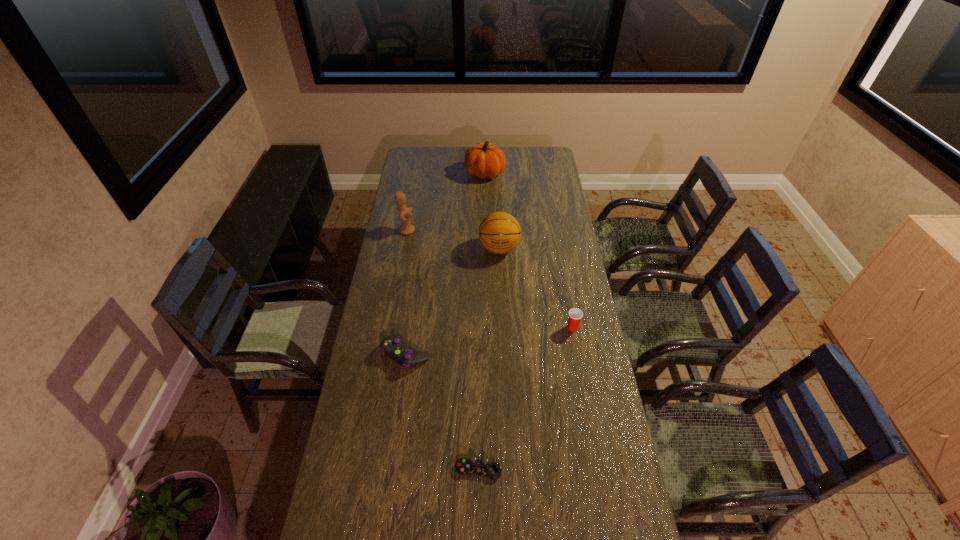
This screenshot has width=960, height=540. What are the coordinates of `free spot between the basketball and the farthest object` in the screenshot? It's located at (492, 211).

Locate an element on the screen. The image size is (960, 540). free spot between the figurine and the right control is located at coordinates (443, 350).

At what (x,y) coordinates should I click in order to perform the action: click on free space that is in between the nearer control and the figurine. Please return your answer as a coordinate pair (x, y). Looking at the image, I should click on (443, 350).

Identify the location of object that is the fourth closest to the right control. This screenshot has width=960, height=540. (406, 228).

At what (x,y) coordinates should I click in order to perform the action: click on object that ranks as the second closest to the fifth farthest object. Please return your answer as a coordinate pair (x, y). Image resolution: width=960 pixels, height=540 pixels. Looking at the image, I should click on (499, 232).

At what (x,y) coordinates should I click in order to perform the action: click on free location that satisfies the following two spatial constraints: 1. on the back side of the fourth farthest object; 2. on the front-facing side of the figurine. Please return your answer as a coordinate pair (x, y). The width and height of the screenshot is (960, 540). Looking at the image, I should click on (555, 230).

You are a GUI agent. You are given a task and a screenshot of the screen. Output one action in this format:
    pyautogui.click(x=<x>, y=<y>)
    Task: Click on the free location that satisfies the following two spatial constraints: 1. on the front-facing side of the rightmost object; 2. on the right side of the figurine
    The height and width of the screenshot is (540, 960).
    Given the screenshot: What is the action you would take?
    pyautogui.click(x=390, y=328)

In order to click on vacant area that satisfies the following two spatial constraints: 1. on the front-facing side of the figurine; 2. on the left side of the second nearest object in this screenshot , I will do `click(385, 354)`.